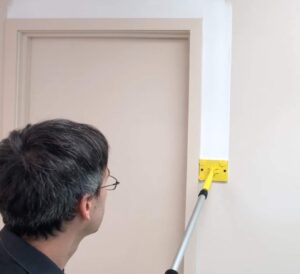
Image resolution: width=300 pixels, height=274 pixels. In order to click on door in this screenshot , I will do [x=140, y=215].